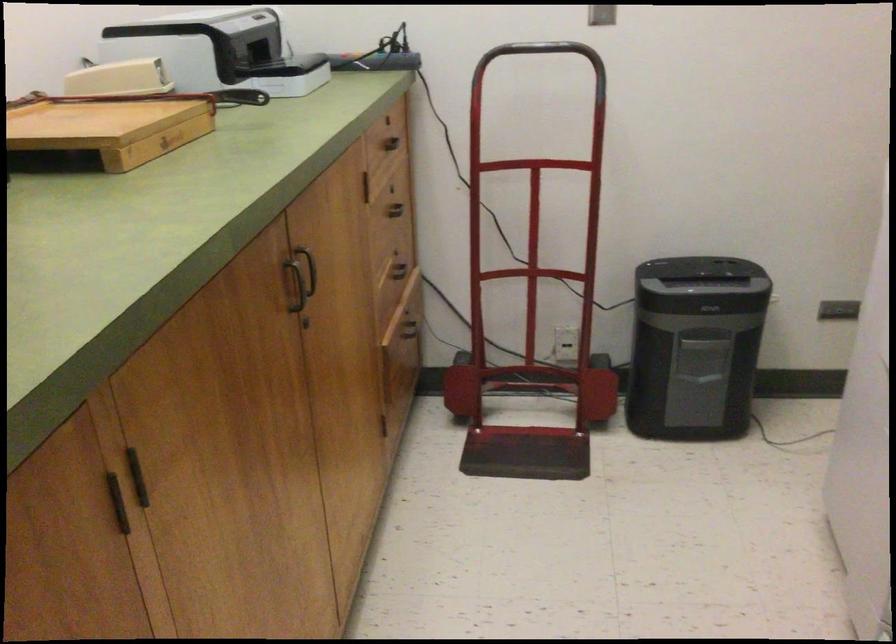
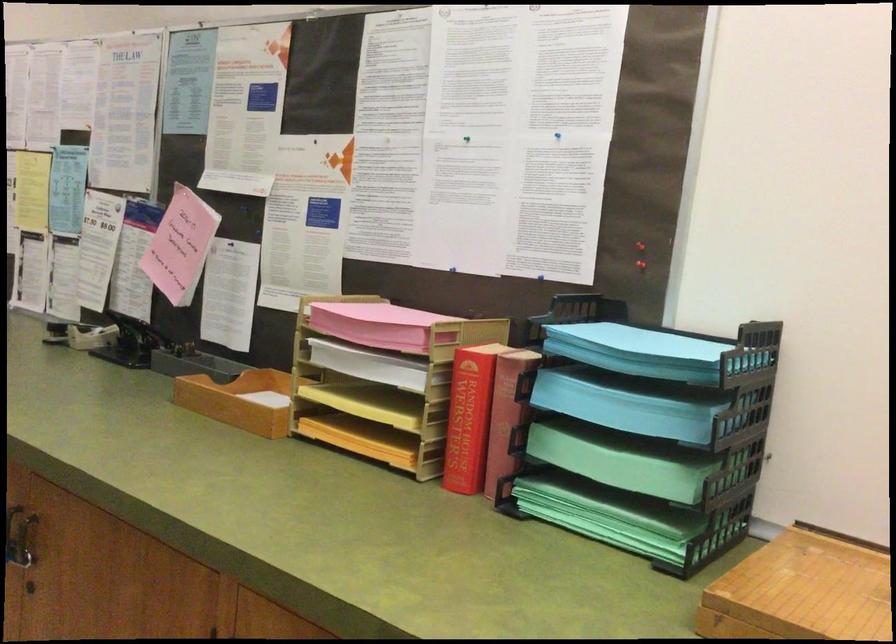
Find the pixel in the second image that matches the point at 95,134 in the first image.

(800, 591)